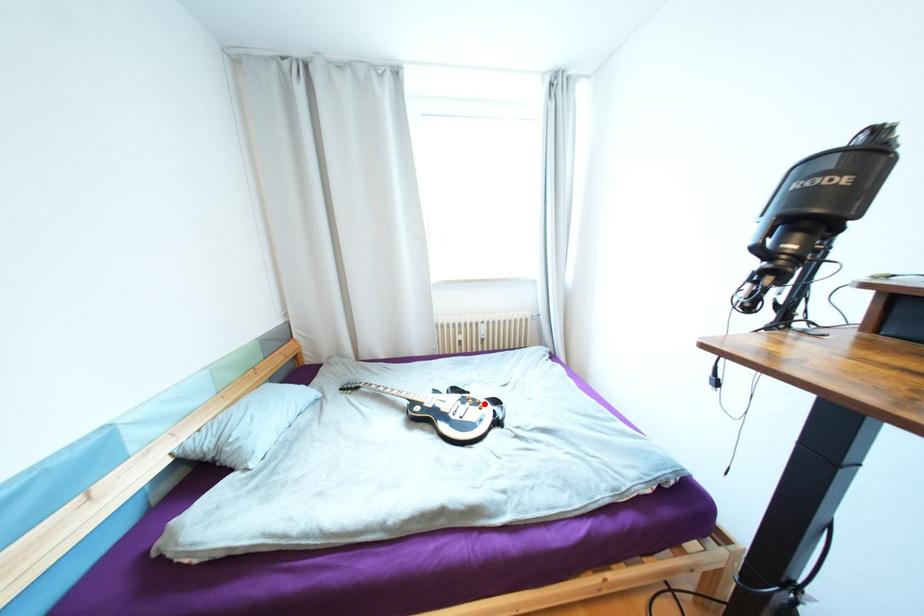
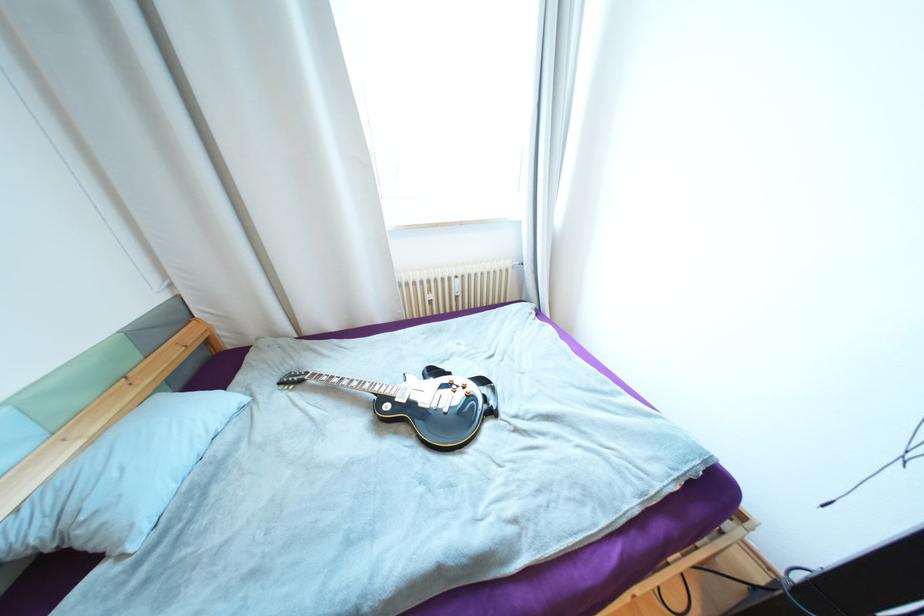
Find the pixel in the second image that matches the highlighted location in the first image.

(469, 387)